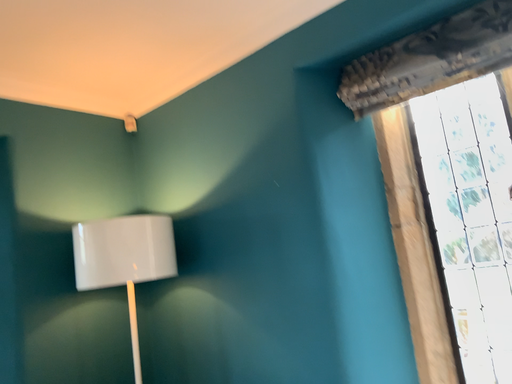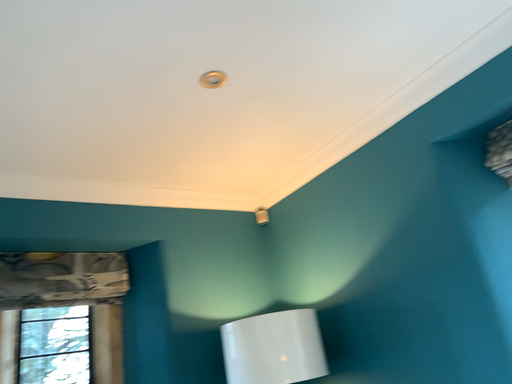
Question: How did the camera likely rotate when shooting the video?

Choices:
 (A) rotated right
 (B) rotated left

Answer: (B)